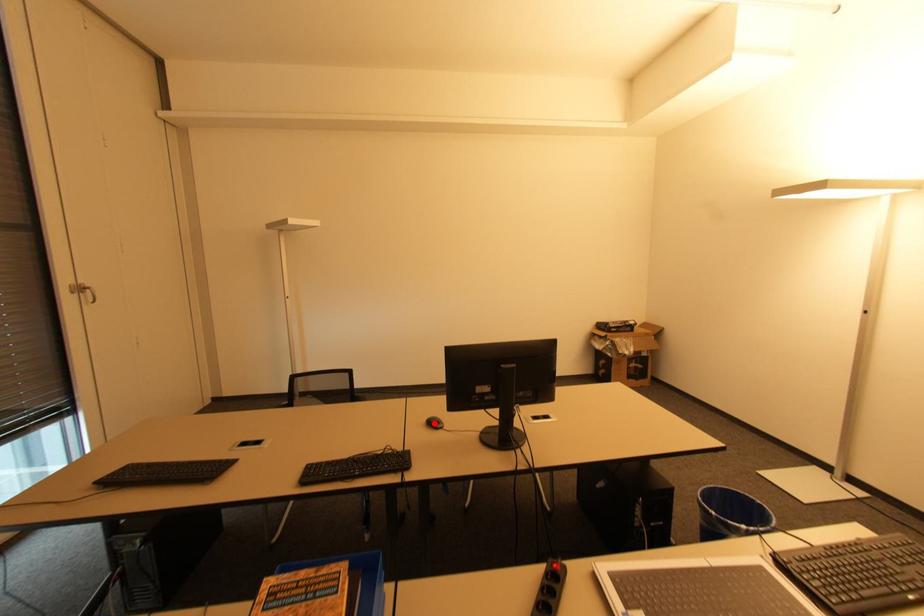
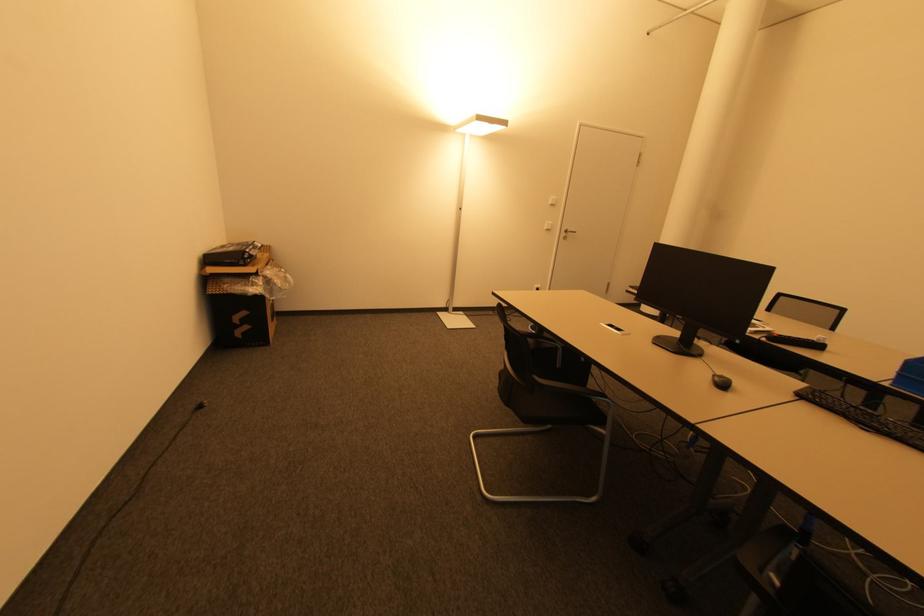
Question: I am providing you with two images of the same scene from different viewpoints. Given a red point in image1, look at the same physical point in image2. Is it:

Choices:
 (A) Closer to the viewpoint
 (B) Farther from the viewpoint

Answer: (A)